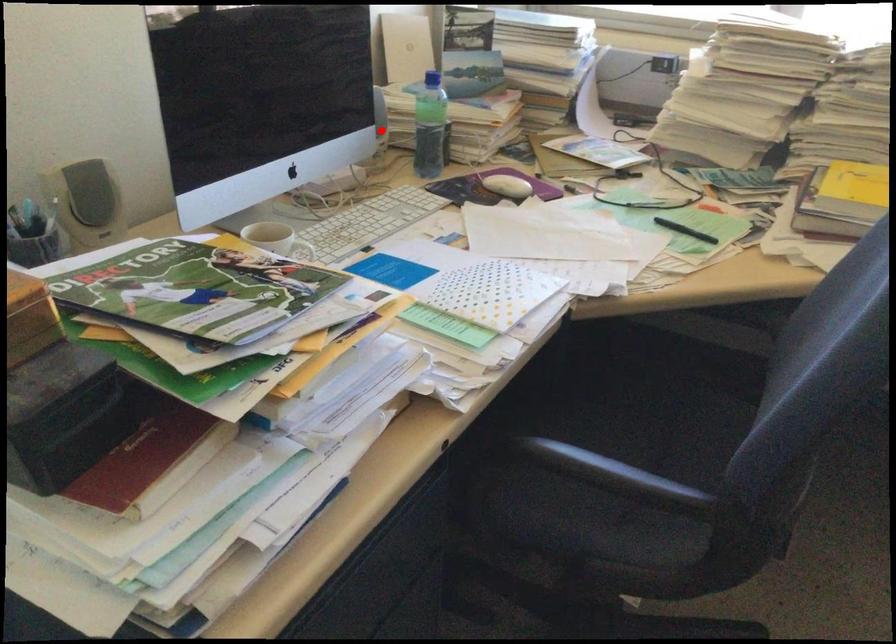
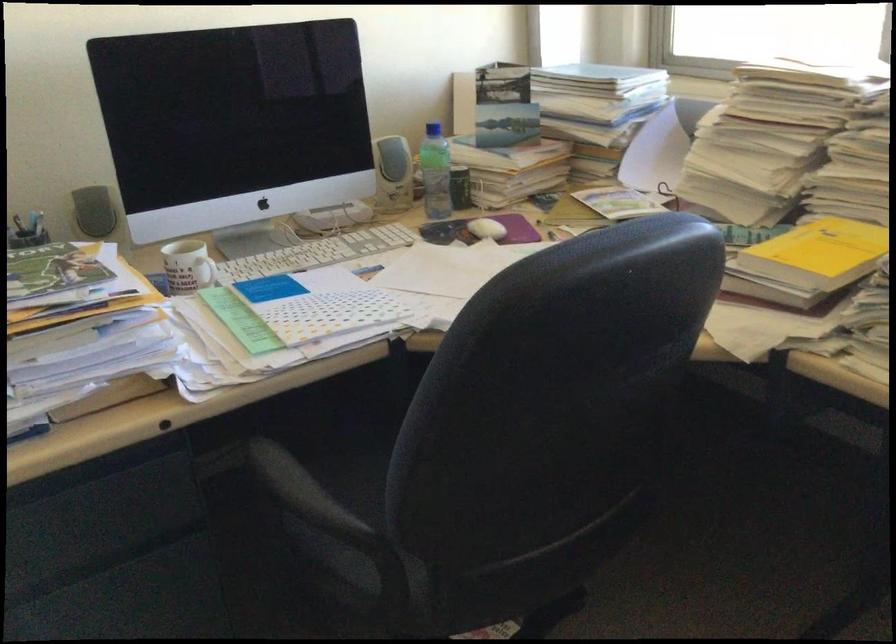
Question: I am providing you with two images of the same scene from different viewpoints. In image1, a red point is highlighted. Considering the same 3D point in image2, which of the following is correct?

Choices:
 (A) It is closer
 (B) It is farther

Answer: (B)